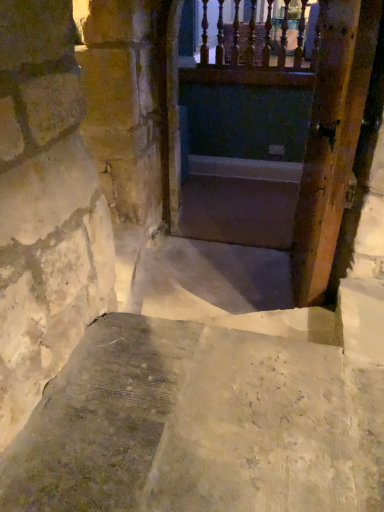
This screenshot has width=384, height=512. I want to click on smooth concrete stairs at center, so click(x=238, y=210).

Describe the element at coordinates (272, 135) in the screenshot. Image resolution: width=384 pixels, height=512 pixels. I see `wooden railing at upper center` at that location.

Where is `wooden door at right`? wooden door at right is located at coordinates (332, 140).

Where is `smooth concrete stairs at center`? The image size is (384, 512). smooth concrete stairs at center is located at coordinates (238, 210).

Consider the image. Considering the positions of objects wooden railing at upper center and smooth concrete stairs at center in the image provided, who is in front, wooden railing at upper center or smooth concrete stairs at center?

wooden railing at upper center is more forward.

Is point (239, 24) positioned before point (215, 181)?

Yes, it is in front of point (215, 181).

Does wooden railing at upper center turn towards smooth concrete stairs at center?

No, wooden railing at upper center does not turn towards smooth concrete stairs at center.

Identify the location of tunnel above the smooth concrete stairs at center (from the image's perspective). (272, 135).

Which is in front, point (305, 275) or point (244, 239)?

The point (305, 275) is closer to the camera.

Which of these two, wooden door at right or smooth concrete stairs at center, is thinner?

wooden door at right.

Can you confirm if wooden door at right is positioned to the left of smooth concrete stairs at center?

In fact, wooden door at right is to the right of smooth concrete stairs at center.

Is the depth of wooden door at right greater than that of smooth concrete stairs at center?

No, wooden door at right is closer to the camera.

From the image's perspective, which one is positioned higher, wooden door at right or wooden railing at upper center?

From the image's view, wooden railing at upper center is above.

Does wooden door at right turn towards wooden railing at upper center?

No, wooden door at right is not turned towards wooden railing at upper center.

Where is `tunnel behind the wooden door at right`? tunnel behind the wooden door at right is located at coordinates (272, 135).

Between wooden door at right and wooden railing at upper center, which one appears on the right side from the viewer's perspective?

wooden door at right.

Is wooden railing at upper center inside the boundaries of wooden door at right, or outside?

wooden railing at upper center lies outside wooden door at right.

What's the angular difference between wooden railing at upper center and wooden door at right's facing directions?

They differ by 82.7 degrees in their facing directions.

Where is `tunnel located above the wooden door at right (from a real-world perspective)`? This screenshot has width=384, height=512. tunnel located above the wooden door at right (from a real-world perspective) is located at coordinates (272, 135).

Which of these two, wooden railing at upper center or wooden door at right, is thinner?

wooden door at right.

In the image, is smooth concrete stairs at center on the left side or the right side of wooden door at right?

smooth concrete stairs at center is positioned on wooden door at right's left side.

Can you confirm if smooth concrete stairs at center is wider than wooden door at right?

Indeed, smooth concrete stairs at center has a greater width compared to wooden door at right.

Does smooth concrete stairs at center have a lesser height compared to wooden door at right?

Yes, smooth concrete stairs at center is shorter than wooden door at right.

From the image's perspective, is smooth concrete stairs at center located beneath wooden door at right?

No.

From the picture: Is smooth concrete stairs at center further to camera compared to wooden railing at upper center?

Yes, the depth of smooth concrete stairs at center is greater than that of wooden railing at upper center.

Is smooth concrete stairs at center at the left side of wooden railing at upper center?

No, smooth concrete stairs at center is not to the left of wooden railing at upper center.

Is point (213, 212) closer to camera compared to point (319, 190)?

That is False.

Where is `stairs below the wooden railing at upper center (from a real-world perspective)`? This screenshot has height=512, width=384. stairs below the wooden railing at upper center (from a real-world perspective) is located at coordinates (238, 210).

In order to click on tunnel that is on the left side of smooth concrete stairs at center in this screenshot , I will do `click(272, 135)`.

This screenshot has width=384, height=512. What are the coordinates of `door lying in front of the smooth concrete stairs at center` in the screenshot? It's located at (332, 140).

Which object lies further to the anchor point wooden door at right, wooden railing at upper center or smooth concrete stairs at center?

wooden railing at upper center is further to wooden door at right.

From the image, which object appears to be nearer to smooth concrete stairs at center, wooden railing at upper center or wooden door at right?

Based on the image, wooden railing at upper center appears to be nearer to smooth concrete stairs at center.

From the image, which object appears to be farther from wooden door at right, smooth concrete stairs at center or wooden railing at upper center?

The object further to wooden door at right is wooden railing at upper center.

Looking at the image, which one is located further to smooth concrete stairs at center, wooden door at right or wooden railing at upper center?

wooden door at right is positioned further to the anchor smooth concrete stairs at center.

From the image, which object appears to be farther from wooden railing at upper center, wooden door at right or smooth concrete stairs at center?

wooden door at right is further to wooden railing at upper center.

Estimate the real-world distances between objects in this image. Which object is further from wooden railing at upper center, smooth concrete stairs at center or wooden door at right?

wooden door at right.

I want to click on tunnel positioned between wooden door at right and smooth concrete stairs at center from near to far, so click(272, 135).